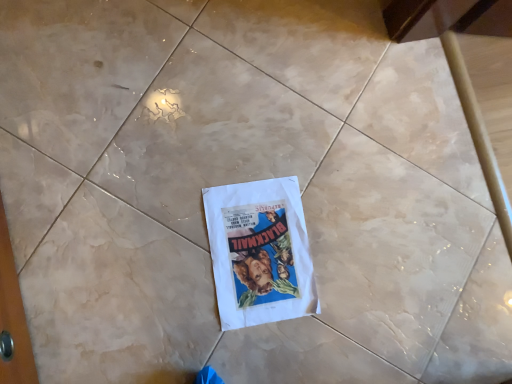
Where is `free space in front of white paper flyer at center`? The width and height of the screenshot is (512, 384). free space in front of white paper flyer at center is located at coordinates [180, 324].